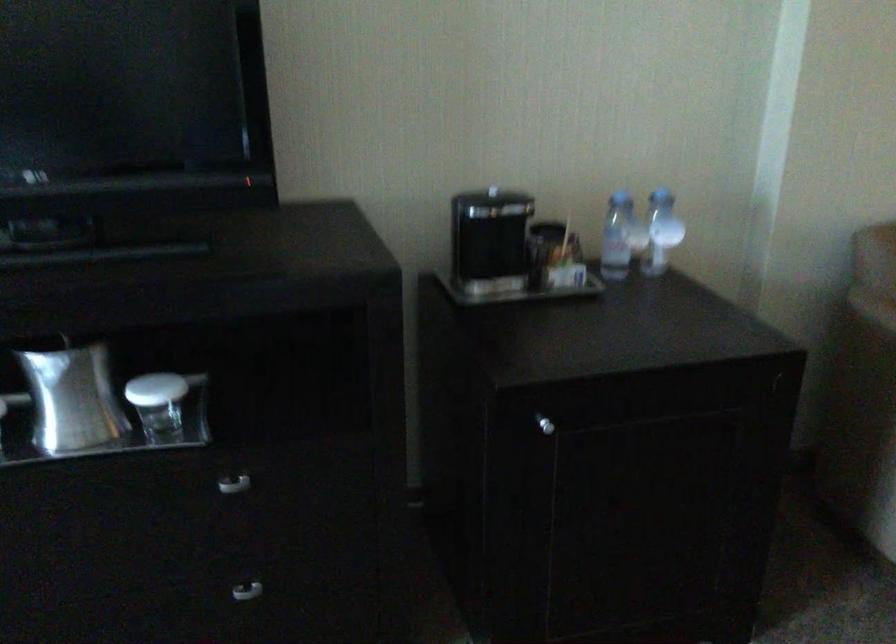
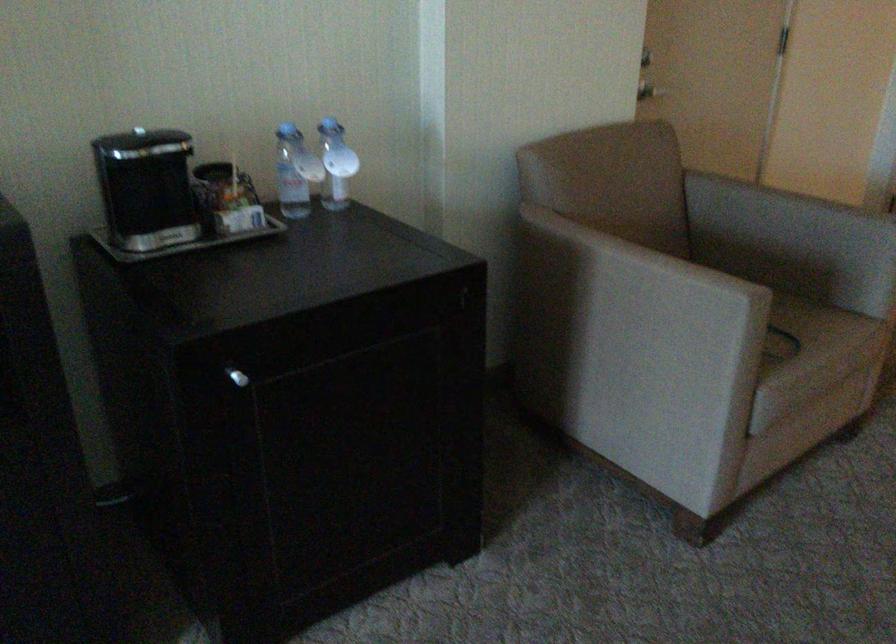
The point at (661, 232) is marked in the first image. Where is the corresponding point in the second image?

(336, 164)